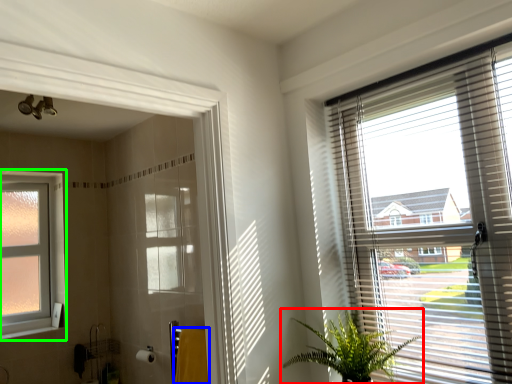
Question: Based on their relative distances, which object is farther from houseplant (highlighted by a red box)? Choose from bath towel (highlighted by a blue box) and window (highlighted by a green box).

Choices:
 (A) bath towel
 (B) window

Answer: (B)